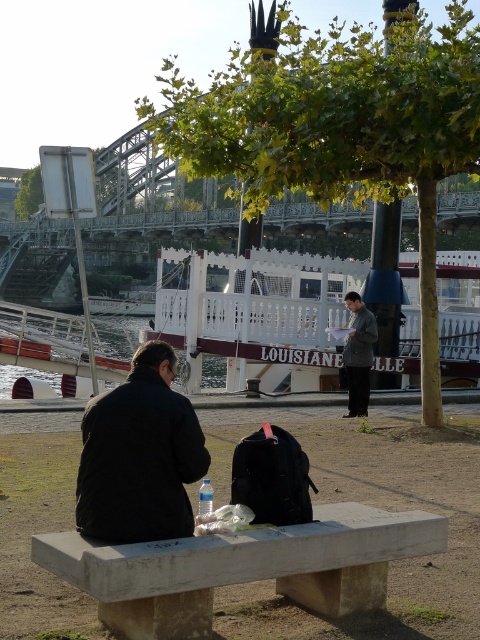
You are a photographer trying to capture a candid shot of the dark gray jacket at center without including the gray concrete bench at lower center in the frame. Based on their relative heights, can you position yourself in a way that the bench is obscured from view while still framing the jacket?

The gray concrete bench at lower center has a lesser height compared to dark gray jacket at center, so positioning yourself at a lower angle or moving closer to the bench while angling the camera upwards could allow the jacket to be visible while the bench is partially hidden behind it or out of the frame.

Looking at this image, you are a photographer trying to capture both the black matte jacket at lower left and the dark gray jacket at center in a single frame. Considering their sizes, which jacket will appear smaller in your photo?

The black matte jacket at lower left will appear smaller in the photo since it has a smaller size compared to the dark gray jacket at center.

You are a photographer trying to capture the two points in the scene. Which point, point (407, 536) or point (351, 410), will appear larger in your photo?

Point (407, 536) will appear larger in the photo because it is closer to the camera than point (351, 410).